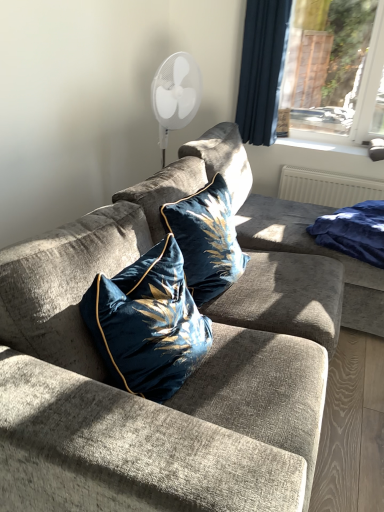
Question: Looking at their shapes, would you say blue velvet blanket at right is wider or thinner than velvet blue pillow at center, which is counted as the 1th pillow, starting from the back?

Choices:
 (A) wide
 (B) thin

Answer: (A)

Question: Based on their sizes in the image, would you say blue velvet blanket at right is bigger or smaller than velvet blue pillow at center, which is counted as the 1th pillow, starting from the back?

Choices:
 (A) big
 (B) small

Answer: (B)

Question: Which object is the closest to the white plastic window sill at upper right?

Choices:
 (A) dark blue velvet curtain at upper right
 (B) velvet fabric couch at center
 (C) blue velvet blanket at right
 (D) velvet blue pillow at center, positioned as the 2th pillow in back-to-front order
 (E) velvet blue pillow at center, which is the 2th pillow from front to back

Answer: (A)

Question: Which object is the farthest from the white plastic window sill at upper right?

Choices:
 (A) blue velvet blanket at right
 (B) velvet blue pillow at center, which is counted as the 1th pillow, starting from the back
 (C) velvet blue pillow at center, arranged as the 1th pillow when viewed from the front
 (D) velvet fabric couch at center
 (E) dark blue velvet curtain at upper right

Answer: (C)